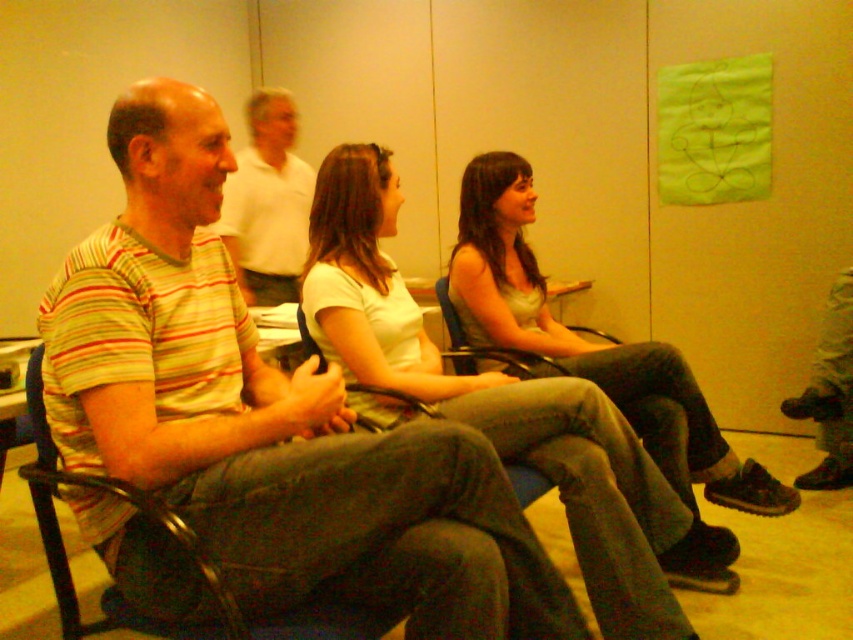
Who is positioned more to the right, white cotton shirt at center or striped cotton shirt at center?

From the viewer's perspective, white cotton shirt at center appears more on the right side.

Can you confirm if white cotton shirt at center is shorter than striped cotton shirt at center?

No.

At what (x,y) coordinates should I click in order to perform the action: click on white cotton shirt at center. Please return your answer as a coordinate pair (x, y). This screenshot has height=640, width=853. Looking at the image, I should click on click(505, 410).

Is point (193, 513) closer to camera compared to point (268, 193)?

Yes, it is.

Who is higher up, striped cotton shirt at left or striped cotton shirt at center?

striped cotton shirt at center is above.

What do you see at coordinates (267, 416) in the screenshot?
I see `striped cotton shirt at left` at bounding box center [267, 416].

Find the location of a particular element. striped cotton shirt at left is located at coordinates (267, 416).

Looking at this image, is striped cotton shirt at left further to the viewer compared to white cotton shirt at center?

No, striped cotton shirt at left is in front of white cotton shirt at center.

From the picture: Is striped cotton shirt at left above white cotton shirt at center?

Actually, striped cotton shirt at left is below white cotton shirt at center.

Locate an element on the screen. striped cotton shirt at left is located at coordinates (267, 416).